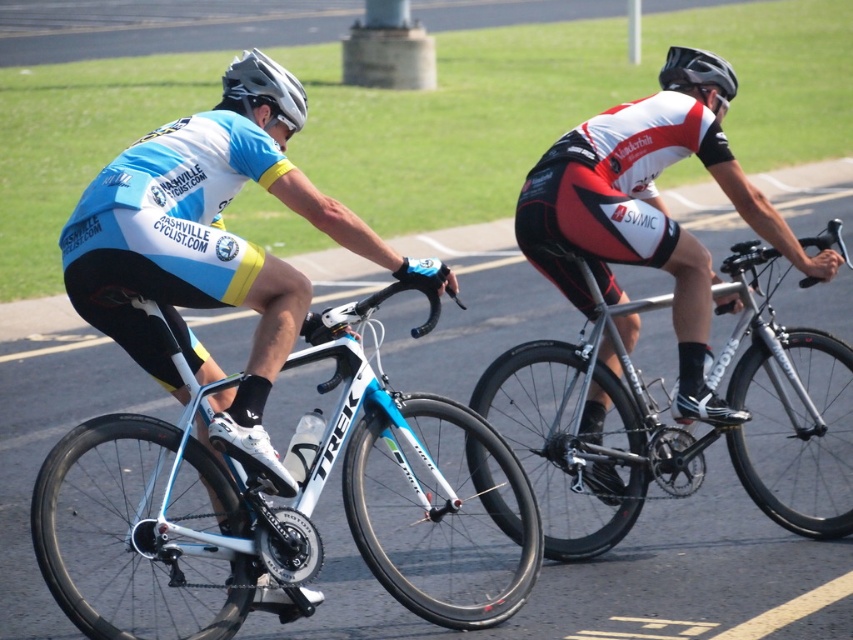
Is matte gray helmet at upper left shorter than black matte helmet at upper center?

Yes, matte gray helmet at upper left is shorter than black matte helmet at upper center.

Which of these two, matte gray helmet at upper left or black matte helmet at upper center, stands taller?

Standing taller between the two is black matte helmet at upper center.

Who is more forward, (303, 108) or (685, 51)?

Positioned in front is point (303, 108).

Find the location of `matte gray helmet at upper left`. matte gray helmet at upper left is located at coordinates (265, 90).

Measure the distance between matte white bicycle at center and camera.

matte white bicycle at center and camera are 17.91 feet apart.

Can you confirm if matte white bicycle at center is bigger than black matte helmet at upper center?

Yes.

Between point (227, 572) and point (683, 56), which one is positioned in front?

Point (227, 572)

The image size is (853, 640). Identify the location of matte white bicycle at center. (271, 512).

Who is lower down, silver metallic bicycle at center or black matte helmet at upper center?

silver metallic bicycle at center is below.

Where is `silver metallic bicycle at center`? The height and width of the screenshot is (640, 853). silver metallic bicycle at center is located at coordinates (671, 426).